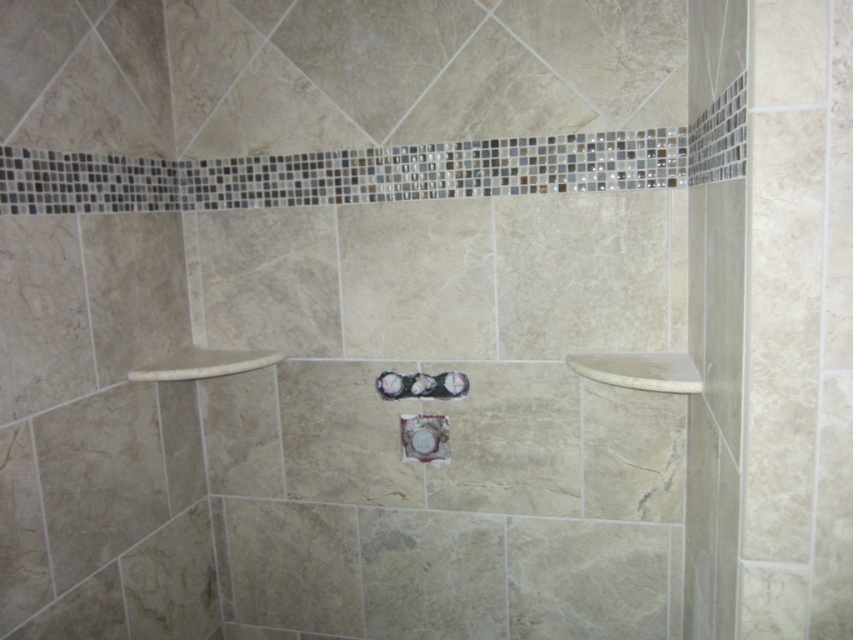
You are designing a layout for a bathroom and need to place a new shelf. The shelf must be positioned to the right of the white marble towel bar at upper left. Where should you place the shelf?

The shelf should be placed to the right of the white marble towel bar at upper left, which is located at point (202, 364). Since the shelf must be positioned to the right of this coordinate, it should be placed at a position with an x coordinate greater than 0.569 and the same y coordinate of 0.239.

Based on the photo, you are installing a new shower curtain rod between the white marble towel bar at upper right and the white marble towel bar at upper left. Which towel bar is above the other?

The white marble towel bar at upper right is positioned over the white marble towel bar at upper left.